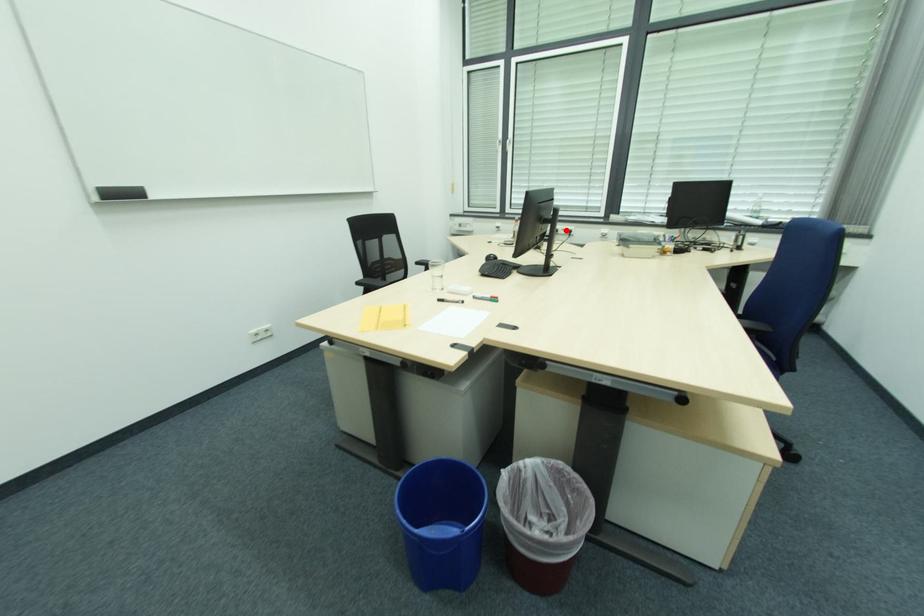
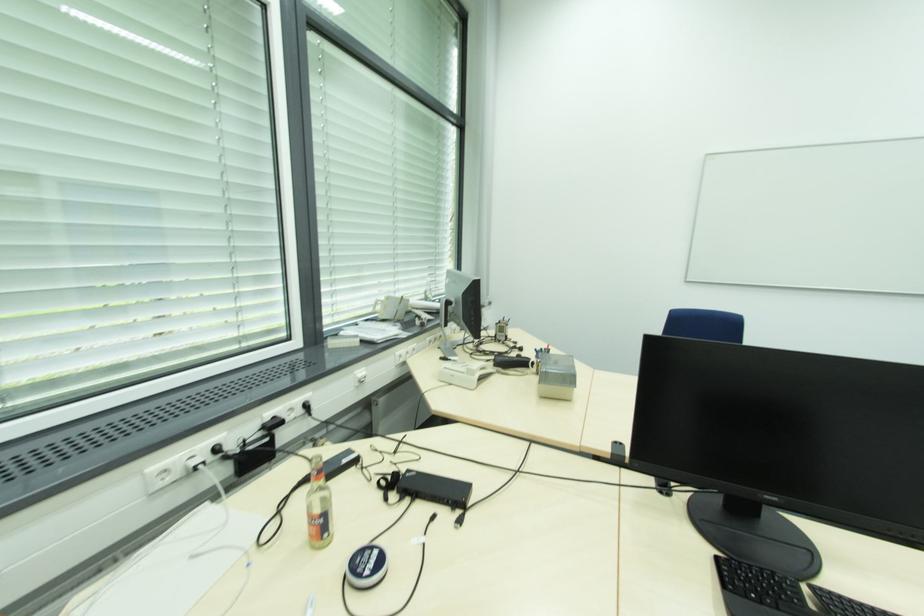
Find the pixel in the second image that matches the highlighted location in the first image.

(294, 410)